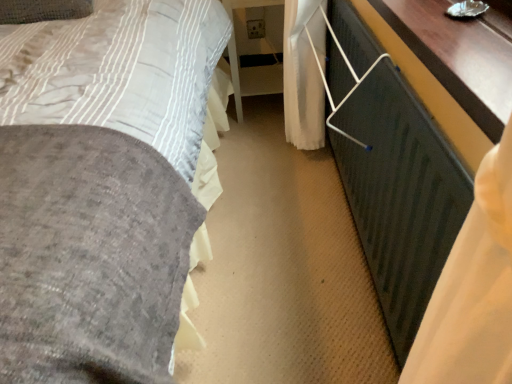
The height and width of the screenshot is (384, 512). I want to click on free space between white glossy table at center, the second table in the right-to-left sequence, and metallic silver balustrade at lower right, so click(x=297, y=198).